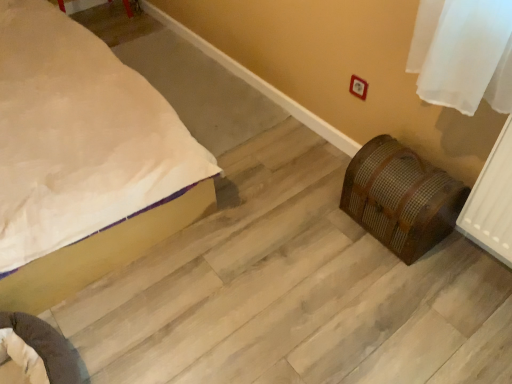
Question: In the image, is brown woven chest at lower right on the left side or the right side of white matte bed at lower left?

Choices:
 (A) right
 (B) left

Answer: (A)

Question: From the image's perspective, is brown woven chest at lower right located above or below white matte bed at lower left?

Choices:
 (A) above
 (B) below

Answer: (B)

Question: From a real-world perspective, relative to white matte bed at lower left, is brown woven chest at lower right vertically above or below?

Choices:
 (A) above
 (B) below

Answer: (B)

Question: Considering the positions of point (117, 246) and point (445, 233), is point (117, 246) closer or farther from the camera than point (445, 233)?

Choices:
 (A) closer
 (B) farther

Answer: (A)

Question: Choose the correct answer: Is white matte bed at lower left inside brown woven chest at lower right or outside it?

Choices:
 (A) inside
 (B) outside

Answer: (B)

Question: In the image, is white matte bed at lower left positioned in front of or behind brown woven chest at lower right?

Choices:
 (A) behind
 (B) front

Answer: (B)

Question: From a real-world perspective, is white matte bed at lower left physically located above or below brown woven chest at lower right?

Choices:
 (A) above
 (B) below

Answer: (A)